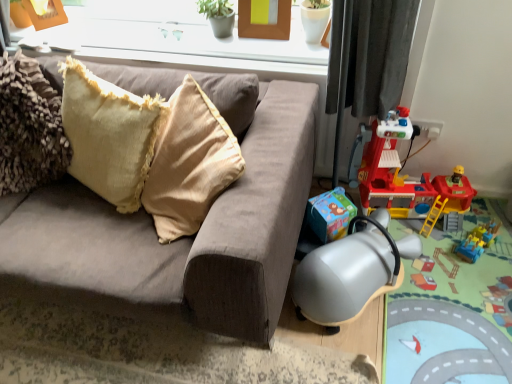
What do you see at coordinates (454, 311) in the screenshot? I see `metallic plastic playset at lower right` at bounding box center [454, 311].

What do you see at coordinates (477, 241) in the screenshot? Image resolution: width=512 pixels, height=384 pixels. I see `blue plastic toy at lower right, placed as the 1th toy when sorted from bottom to top` at bounding box center [477, 241].

What is the approximate height of blue plastic toy at lower right, the second toy viewed from the top?

3.59 inches.

The width and height of the screenshot is (512, 384). What do you see at coordinates (183, 32) in the screenshot?
I see `white plastic window frame at upper center` at bounding box center [183, 32].

Find the location of a particular element. The height and width of the screenshot is (384, 512). velvet gray couch at left is located at coordinates (186, 237).

The width and height of the screenshot is (512, 384). Describe the element at coordinates (351, 272) in the screenshot. I see `metallic gray swivel chair at lower right` at that location.

Find the location of a particular element. This screenshot has width=512, height=384. beige textured pillow at upper left is located at coordinates (109, 134).

In order to face beige textured pillow at upper left, should I rotate leftwards or rightwards?

Turn left approximately 19.641 degrees to face it.

Describe the element at coordinates (406, 178) in the screenshot. I see `plastic red fire station at right, which ranks as the first toy in top-to-bottom order` at that location.

The height and width of the screenshot is (384, 512). I want to click on brown wooden picture frame at upper center, so click(264, 19).

Locate an element on the screen. Image resolution: width=512 pixels, height=384 pixels. metallic plastic playset at lower right is located at coordinates (454, 311).

Is the position of velvet gray couch at left less distant than that of white plastic window frame at upper center?

Yes, the depth of velvet gray couch at left is less than that of white plastic window frame at upper center.

Considering the sizes of objects velvet gray couch at left and white plastic window frame at upper center in the image provided, who is taller, velvet gray couch at left or white plastic window frame at upper center?

With more height is velvet gray couch at left.

Can we say velvet gray couch at left lies outside white plastic window frame at upper center?

Yes, velvet gray couch at left is located beyond the bounds of white plastic window frame at upper center.

Considering the sizes of velvet gray couch at left and white plastic window frame at upper center in the image, is velvet gray couch at left wider or thinner than white plastic window frame at upper center?

velvet gray couch at left is wider than white plastic window frame at upper center.

Consider the image. From the image's perspective, who appears lower, metallic gray swivel chair at lower right or metallic plastic playset at lower right?

metallic plastic playset at lower right appears lower in the image.

From a real-world perspective, relative to metallic plastic playset at lower right, is metallic gray swivel chair at lower right vertically above or below?

metallic gray swivel chair at lower right is above metallic plastic playset at lower right.

Is metallic gray swivel chair at lower right surrounding metallic plastic playset at lower right?

No.

Between velvet gray couch at left and plastic red fire station at right, which ranks as the first toy in top-to-bottom order, which one appears on the left side from the viewer's perspective?

Positioned to the left is velvet gray couch at left.

Does point (253, 183) appear closer or farther from the camera than point (388, 148)?

Point (253, 183) is positioned closer to the camera compared to point (388, 148).

Which of these two, velvet gray couch at left or plastic red fire station at right, which ranks as the first toy in top-to-bottom order, is thinner?

plastic red fire station at right, which ranks as the first toy in top-to-bottom order.

Does velvet gray couch at left have a smaller size compared to plastic red fire station at right, positioned as the second toy in bottom-to-top order?

Actually, velvet gray couch at left might be larger than plastic red fire station at right, positioned as the second toy in bottom-to-top order.

Looking at the image, does metallic gray swivel chair at lower right seem bigger or smaller compared to beige textured pillow at upper left?

Considering their sizes, metallic gray swivel chair at lower right takes up less space than beige textured pillow at upper left.

Consider the image. Is metallic gray swivel chair at lower right inside the boundaries of beige textured pillow at upper left, or outside?

The correct answer is: outside.

From the image's perspective, does metallic gray swivel chair at lower right appear higher than beige textured pillow at upper left?

No, from the image's perspective, metallic gray swivel chair at lower right is not above beige textured pillow at upper left.

Find the location of a particular element. Image resolution: width=512 pixels, height=384 pixels. pillow to the left of metallic gray swivel chair at lower right is located at coordinates (109, 134).

Is metallic gray swivel chair at lower right at the right side of velvet gray couch at left?

Yes, metallic gray swivel chair at lower right is to the right of velvet gray couch at left.

Does metallic gray swivel chair at lower right have a lesser height compared to velvet gray couch at left?

Correct, metallic gray swivel chair at lower right is not as tall as velvet gray couch at left.

Does metallic gray swivel chair at lower right have a smaller size compared to velvet gray couch at left?

Yes, metallic gray swivel chair at lower right is smaller than velvet gray couch at left.

From the image's perspective, is metallic gray swivel chair at lower right located beneath velvet gray couch at left?

Correct, metallic gray swivel chair at lower right appears lower than velvet gray couch at left in the image.

Can you confirm if white plastic window frame at upper center is wider than plastic red fire station at right, which ranks as the first toy in top-to-bottom order?

In fact, white plastic window frame at upper center might be narrower than plastic red fire station at right, which ranks as the first toy in top-to-bottom order.

Which of these two, white plastic window frame at upper center or plastic red fire station at right, which ranks as the first toy in top-to-bottom order, is smaller?

With smaller size is white plastic window frame at upper center.

Is white plastic window frame at upper center outside of plastic red fire station at right, positioned as the second toy in bottom-to-top order?

white plastic window frame at upper center lies outside plastic red fire station at right, positioned as the second toy in bottom-to-top order,'s area.

How many degrees apart are the facing directions of white plastic window frame at upper center and plastic red fire station at right, which ranks as the first toy in top-to-bottom order?

The facing directions of white plastic window frame at upper center and plastic red fire station at right, which ranks as the first toy in top-to-bottom order, are 1.21e-05 degrees apart.

From the picture: Considering the relative positions of brown wooden picture frame at upper center and beige textured pillow at upper left in the image provided, is brown wooden picture frame at upper center to the right of beige textured pillow at upper left from the viewer's perspective?

Correct, you'll find brown wooden picture frame at upper center to the right of beige textured pillow at upper left.

How much distance is there between brown wooden picture frame at upper center and beige textured pillow at upper left?

30.15 inches.

Which is less distant, (x=288, y=32) or (x=76, y=133)?

Point (x=288, y=32) is positioned farther from the camera compared to point (x=76, y=133).

The width and height of the screenshot is (512, 384). In order to click on studio couch below the white plastic window frame at upper center (from a real-world perspective) in this screenshot , I will do `click(186, 237)`.

This screenshot has width=512, height=384. Identify the location of swivel chair located in front of the metallic plastic playset at lower right. (351, 272).

Which object lies further to the anchor point plastic red fire station at right, which ranks as the first toy in top-to-bottom order, velvet gray couch at left or white plastic window frame at upper center?

The object further to plastic red fire station at right, which ranks as the first toy in top-to-bottom order, is white plastic window frame at upper center.

Looking at this image, based on their spatial positions, is white plastic window frame at upper center or velvet gray couch at left further from blue plastic toy at lower right, the second toy viewed from the top?

Based on the image, white plastic window frame at upper center appears to be further to blue plastic toy at lower right, the second toy viewed from the top.

From the picture: From the image, which object appears to be nearer to white plastic window frame at upper center, metallic gray swivel chair at lower right or velvet gray couch at left?

Among the two, velvet gray couch at left is located nearer to white plastic window frame at upper center.

Considering their positions, is metallic gray swivel chair at lower right positioned further to plastic red fire station at right, positioned as the second toy in bottom-to-top order, than brown wooden picture frame at upper center?

The object further to plastic red fire station at right, positioned as the second toy in bottom-to-top order, is brown wooden picture frame at upper center.

When comparing their distances from metallic plastic playset at lower right, does brown wooden picture frame at upper center or beige textured pillow at upper left seem further?

brown wooden picture frame at upper center is positioned further to the anchor metallic plastic playset at lower right.

Which object lies further to the anchor point plastic red fire station at right, positioned as the second toy in bottom-to-top order, metallic plastic playset at lower right or velvet gray couch at left?

Among the two, velvet gray couch at left is located further to plastic red fire station at right, positioned as the second toy in bottom-to-top order.

Considering their positions, is white plastic window frame at upper center positioned closer to beige textured pillow at upper left than plastic red fire station at right, which ranks as the first toy in top-to-bottom order?

Among the two, white plastic window frame at upper center is located nearer to beige textured pillow at upper left.

Looking at the image, which one is located closer to metallic gray swivel chair at lower right, velvet gray couch at left or metallic plastic playset at lower right?

The object closer to metallic gray swivel chair at lower right is metallic plastic playset at lower right.

Image resolution: width=512 pixels, height=384 pixels. Find the location of `window frame between brown wooden picture frame at upper center and beige textured pillow at upper left in the up-down direction`. window frame between brown wooden picture frame at upper center and beige textured pillow at upper left in the up-down direction is located at coordinates (183, 32).

Locate an element on the screen. This screenshot has width=512, height=384. picture frame situated between velvet gray couch at left and blue plastic toy at lower right, the second toy viewed from the top, from left to right is located at coordinates (264, 19).

Find the location of a particular element. table between velvet gray couch at left and blue plastic toy at lower right, placed as the 1th toy when sorted from bottom to top is located at coordinates (454, 311).

Where is `swivel chair that lies between brown wooden picture frame at upper center and metallic plastic playset at lower right from top to bottom`? swivel chair that lies between brown wooden picture frame at upper center and metallic plastic playset at lower right from top to bottom is located at coordinates (351, 272).